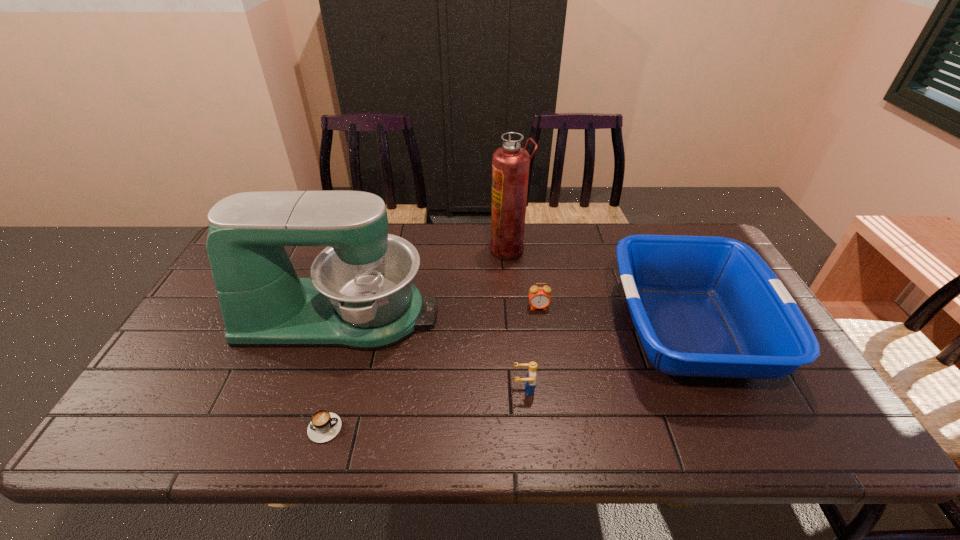
You are a GUI agent. You are given a task and a screenshot of the screen. Output one action in this format:
    pyautogui.click(x=<x>, y=<y>)
    Task: Click on the farthest object
    The width and height of the screenshot is (960, 540).
    Given the screenshot: What is the action you would take?
    pyautogui.click(x=510, y=163)

Where is `mixer`? mixer is located at coordinates (360, 295).

Locate an element on the screen. the rightmost object is located at coordinates (703, 306).

Image resolution: width=960 pixels, height=540 pixels. I want to click on the third tallest object, so click(x=703, y=306).

In order to click on Lego in this screenshot , I will do `click(530, 382)`.

This screenshot has height=540, width=960. I want to click on alarm clock, so click(x=539, y=297).

The image size is (960, 540). I want to click on the shortest object, so click(x=324, y=426).

You are a GUI agent. You are given a task and a screenshot of the screen. Output one action in this format:
    pyautogui.click(x=<x>, y=<y>)
    Task: Click on the nearest object
    
    Given the screenshot: What is the action you would take?
    pyautogui.click(x=324, y=426)

The height and width of the screenshot is (540, 960). Identify the location of vacant space located on the side of the farthest object with the label. (447, 249).

Identify the location of vacant space located on the side of the farthest object with the label. (457, 249).